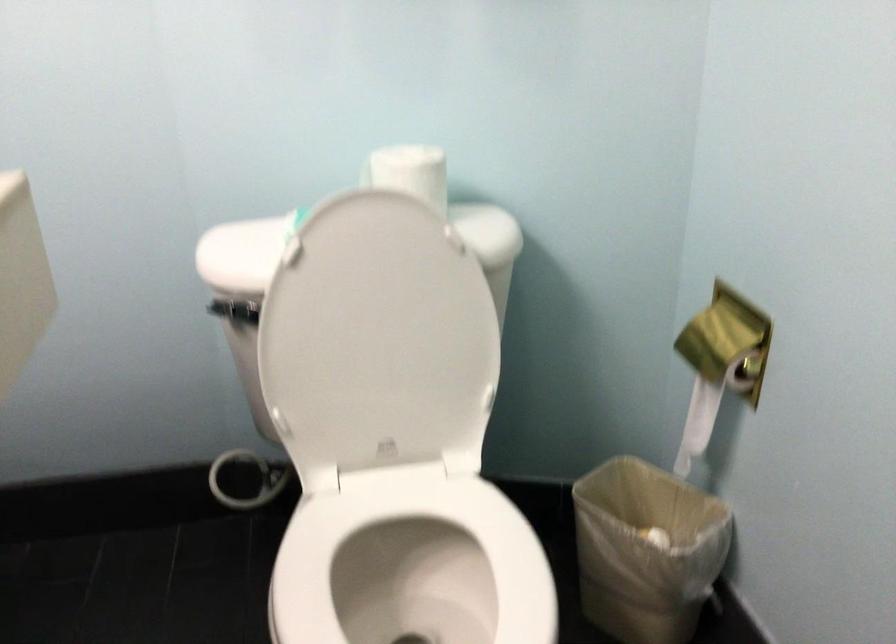
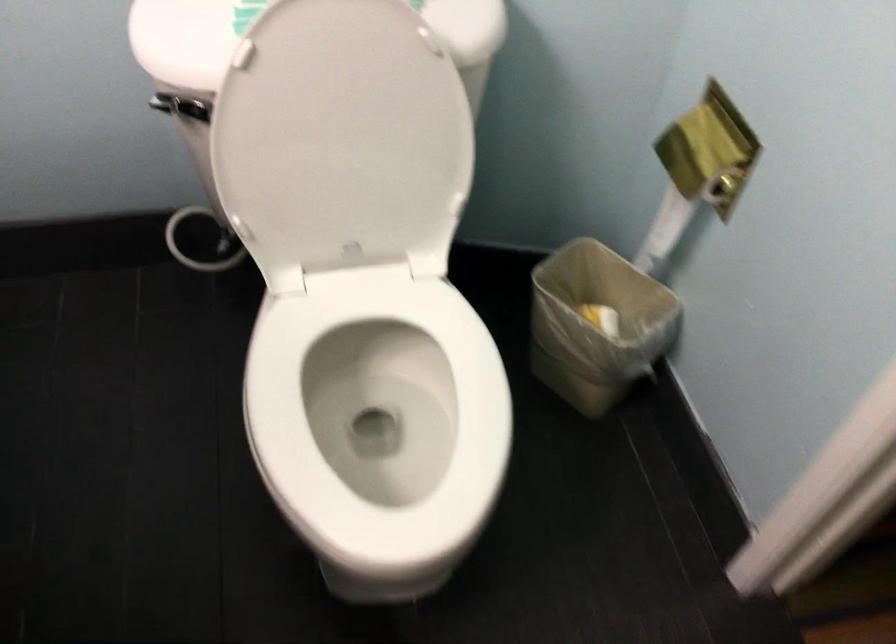
Question: The first image is from the beginning of the video and the second image is from the end. How did the camera likely rotate when shooting the video?

Choices:
 (A) Left
 (B) Right
 (C) Up
 (D) Down

Answer: (D)